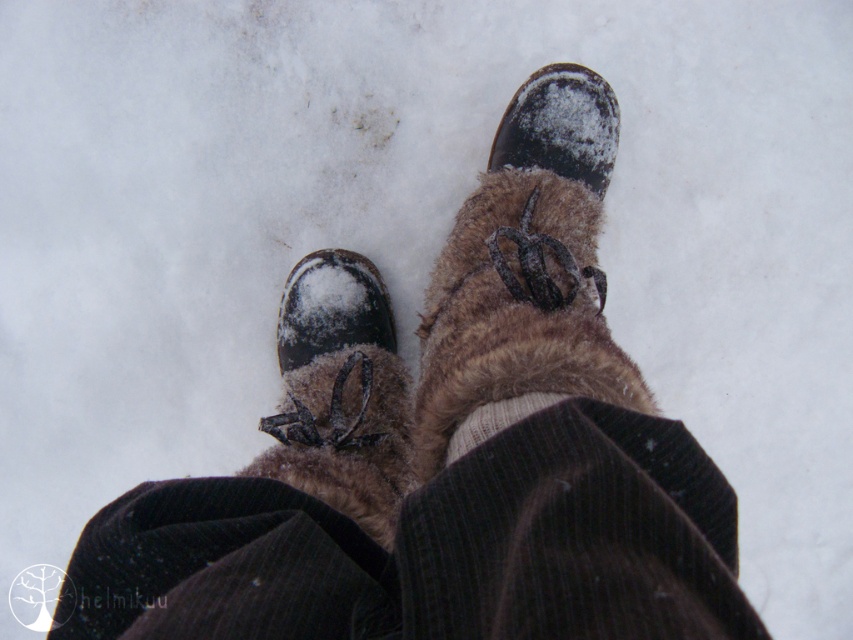
Between brown fuzzy boot at center and white knitted sock at center, which one is positioned lower?

white knitted sock at center is below.

I want to click on brown fuzzy boot at center, so click(x=526, y=269).

How much distance is there between brown fuzzy boot at center and fuzzy brown boot at center?

A distance of 19.66 centimeters exists between brown fuzzy boot at center and fuzzy brown boot at center.

Which is below, brown fuzzy boot at center or fuzzy brown boot at center?

fuzzy brown boot at center

Locate an element on the screen. This screenshot has width=853, height=640. brown fuzzy boot at center is located at coordinates (526, 269).

From the picture: Can you confirm if fuzzy brown boot at center is thinner than white knitted sock at center?

No.

Which is below, fuzzy brown boot at center or white knitted sock at center?

Positioned lower is fuzzy brown boot at center.

Find the location of a particular element. fuzzy brown boot at center is located at coordinates (339, 392).